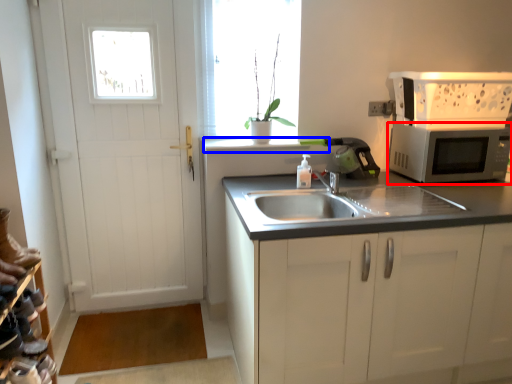
Question: Which point is further to the camera, microwave oven (highlighted by a red box) or window sill (highlighted by a blue box)?

Choices:
 (A) microwave oven
 (B) window sill

Answer: (B)